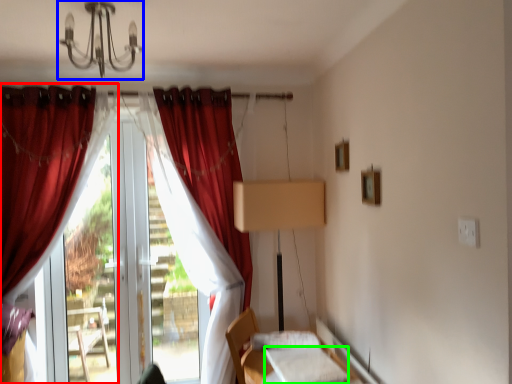
Question: Considering the real-world distances, which object is closest to curtain (highlighted by a red box)? light fixture (highlighted by a blue box) or sheet (highlighted by a green box).

Choices:
 (A) light fixture
 (B) sheet

Answer: (A)